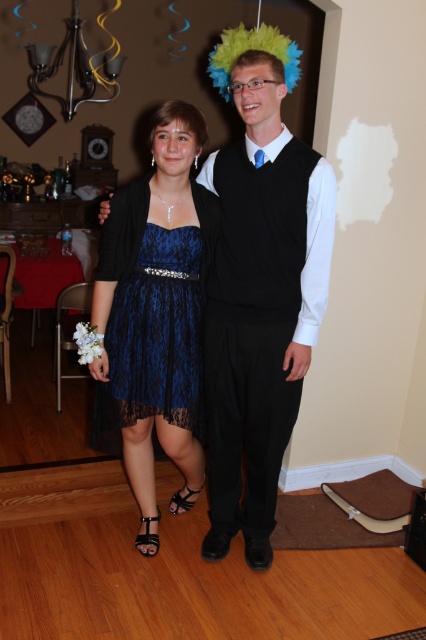
Question: Does navy lace dress at center appear over lace blue dress at center?

Choices:
 (A) yes
 (B) no

Answer: (B)

Question: Which point is farther to the camera?

Choices:
 (A) (273, 307)
 (B) (160, 346)
 (C) (178, 461)

Answer: (C)

Question: Is navy lace dress at center to the right of lace blue dress at center from the viewer's perspective?

Choices:
 (A) yes
 (B) no

Answer: (B)

Question: Which point is farther to the camera?

Choices:
 (A) (166, 355)
 (B) (252, 76)
 (C) (164, 150)

Answer: (A)

Question: Which point appears closest to the camera in this image?

Choices:
 (A) (132, 445)
 (B) (271, 122)

Answer: (B)

Question: Does blue lace dress at center lie in front of navy lace dress at center?

Choices:
 (A) yes
 (B) no

Answer: (A)